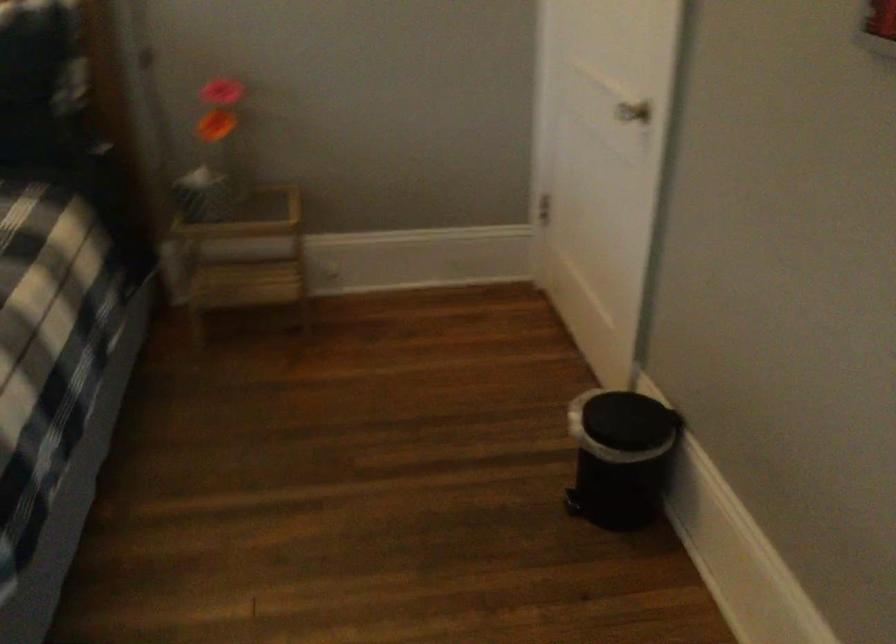
Find where to press the trash can pedal. Please return your answer as a coordinate pair (x, y).

(573, 504)